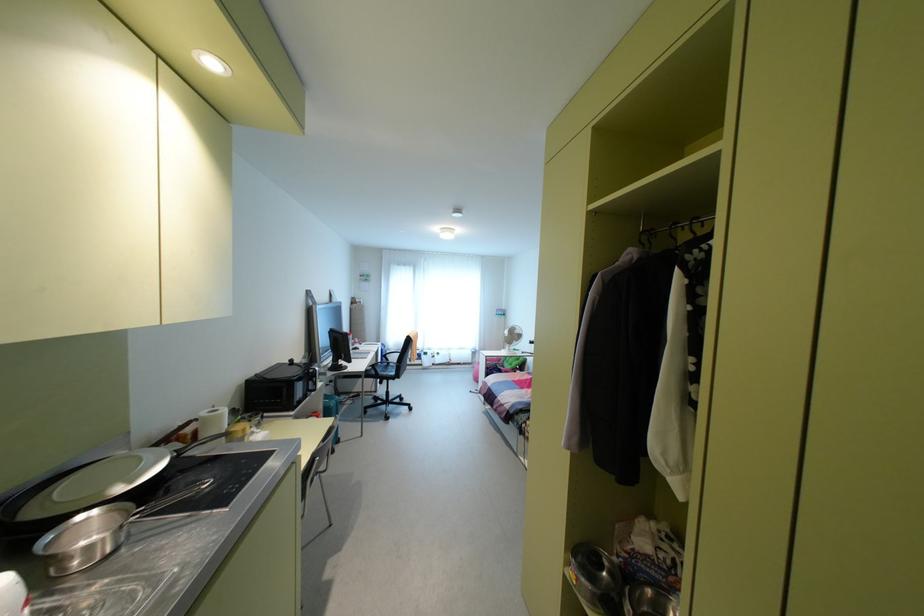
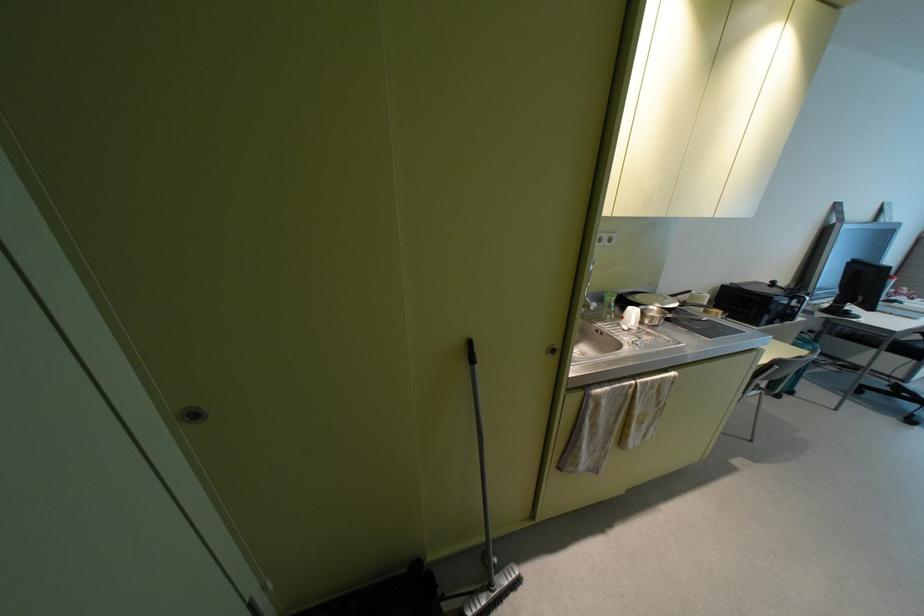
The images are taken continuously from a first-person perspective. In which direction is your viewpoint rotating?

The camera's rotation is toward left-down.